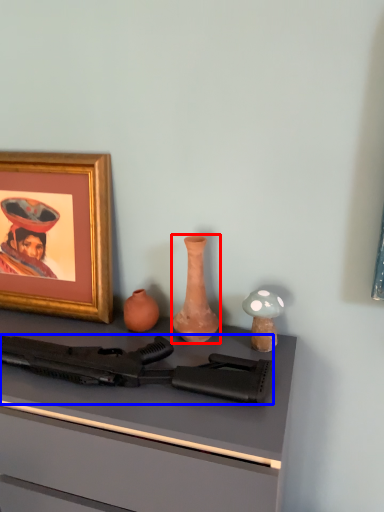
Question: Which of the following is the farthest to the observer, vase (highlighted by a red box) or rifle (highlighted by a blue box)?

Choices:
 (A) vase
 (B) rifle

Answer: (A)